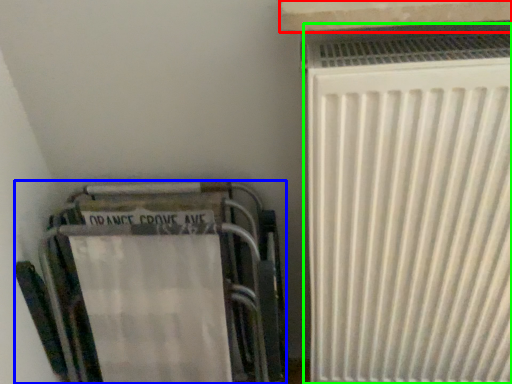
Question: Which object is the farthest from window sill (highlighted by a red box)? Choose among these: furniture (highlighted by a blue box) or radiator (highlighted by a green box).

Choices:
 (A) furniture
 (B) radiator

Answer: (A)